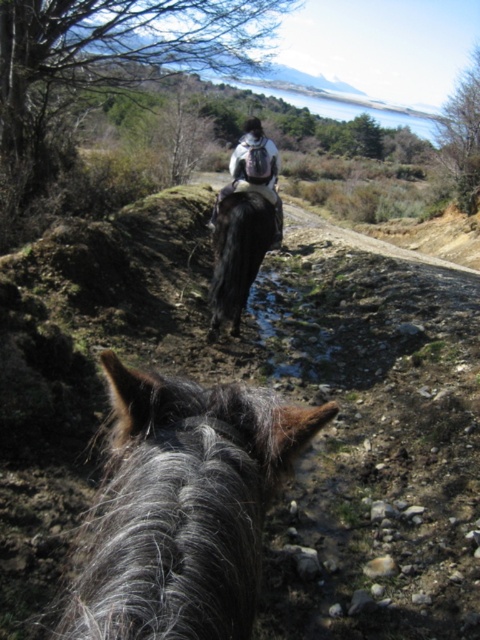
You are a photographer trying to capture the gray fuzzy horse at center and the white matte backpack at center in a single frame. Based on their sizes, which object should you focus on first to ensure it fits properly in the photo?

The gray fuzzy horse at center is thinner than the white matte backpack at center, so you should focus on the white matte backpack at center first to ensure it fits properly in the photo since it is wider.

You are standing at the camera position and want to throw a small ball to the gray fuzzy horse at center. The ball has a maximum throwing distance of 25 inches. Will you be able to reach the horse?

The gray fuzzy horse at center is 25.78 inches away from camera. The ball has a maximum throwing distance of 25 inches, so you cannot reach the horse.